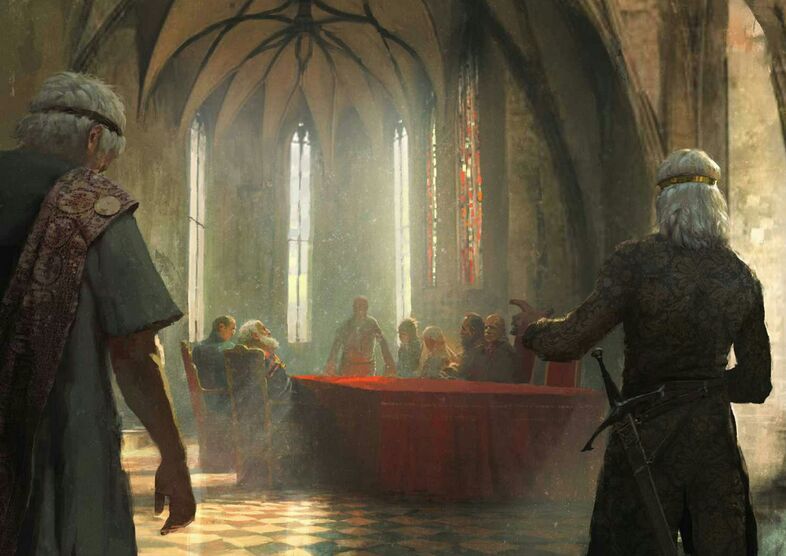
Locate an element on the screen. The image size is (786, 556). sash is located at coordinates (61, 245).